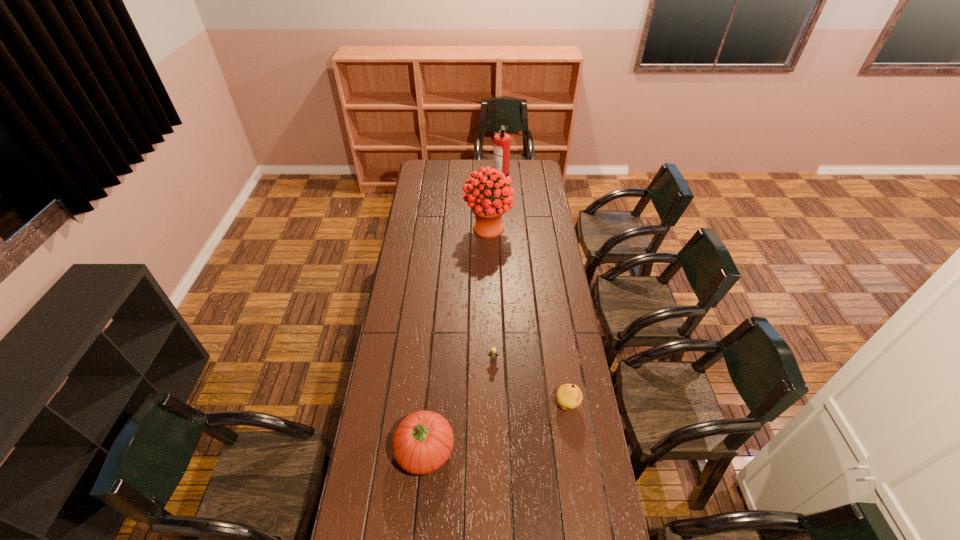
You are a GUI agent. You are given a task and a screenshot of the screen. Output one action in this format:
    pyautogui.click(x=<x>, y=<y>)
    Task: Click on the bouquet
    The width and height of the screenshot is (960, 540).
    Given the screenshot: What is the action you would take?
    pyautogui.click(x=488, y=208)

Identify the location of the farthest object. Image resolution: width=960 pixels, height=540 pixels. (502, 140).

I want to click on the third tallest object, so click(x=423, y=441).

What are the coordinates of `the leftmost object` in the screenshot? It's located at (423, 441).

Where is `pear`? pear is located at coordinates 569,396.

Where is `the rightmost object`? The height and width of the screenshot is (540, 960). the rightmost object is located at coordinates [569, 396].

Identify the location of Lego. This screenshot has width=960, height=540. (493, 355).

Where is `the shortest object`? the shortest object is located at coordinates (493, 355).

Identify the location of vacant space situated 0.280m on the back of the bouquet. The height and width of the screenshot is (540, 960). (487, 186).

Where is `vacant region located on the front-facing side of the fire extinguisher`? vacant region located on the front-facing side of the fire extinguisher is located at coordinates (480, 177).